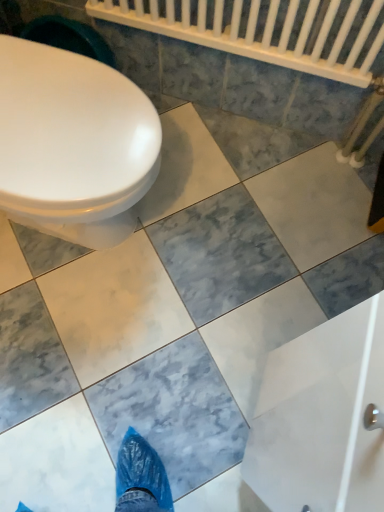
This screenshot has height=512, width=384. In order to click on white glossy toilet at left in this screenshot , I will do `click(73, 144)`.

What do you see at coordinates (73, 144) in the screenshot? I see `white glossy toilet at left` at bounding box center [73, 144].

This screenshot has height=512, width=384. Find the location of `white glossy toilet at left`. white glossy toilet at left is located at coordinates (73, 144).